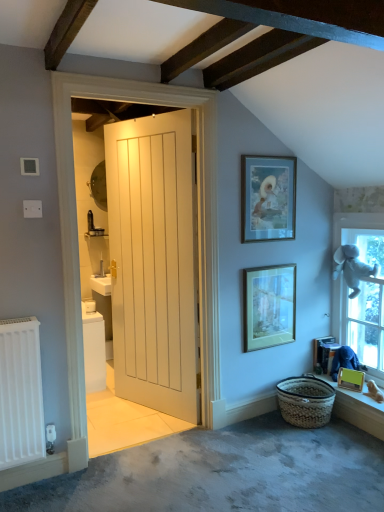
You are a GUI agent. You are given a task and a screenshot of the screen. Output one action in this format:
    pyautogui.click(x=<x>, y=<y>)
    Task: Click on the wooden changing table at lower right
    The width and height of the screenshot is (384, 512).
    Given the screenshot: What is the action you would take?
    pyautogui.click(x=324, y=353)

This screenshot has height=512, width=384. Identify the location of matte glass picture frame at center, the second picture frame from the bottom. (269, 306).

Where is `wooden window sill at lower right`? The height and width of the screenshot is (512, 384). wooden window sill at lower right is located at coordinates [x=358, y=409].

In order to face white plush toy at right, should I rotate leftwards or rightwards?

To face it directly, rotate right by 21.962 degrees.

Locate an element on the screen. matte yellow picture frame at lower right, the 3th picture frame in the top-to-bottom sequence is located at coordinates (350, 379).

Is white wooden door at center taller than matte gold picture frame at upper center, placed as the third picture frame when sorted from bottom to top?

Correct, white wooden door at center is much taller as matte gold picture frame at upper center, placed as the third picture frame when sorted from bottom to top.

From the image's perspective, is white wooden door at center located above or below matte gold picture frame at upper center, placed as the third picture frame when sorted from bottom to top?

white wooden door at center is situated lower than matte gold picture frame at upper center, placed as the third picture frame when sorted from bottom to top, in the image.

Is point (174, 157) behind point (286, 158)?

No, (174, 157) is closer to viewer.

Is wooden changing table at lower right positioned in front of white plush toy at right?

No, it is behind white plush toy at right.

Considering the sizes of objects wooden changing table at lower right and white plush toy at right in the image provided, who is thinner, wooden changing table at lower right or white plush toy at right?

white plush toy at right.

Is wooden changing table at lower right oriented away from white plush toy at right?

Yes, wooden changing table at lower right's orientation is away from white plush toy at right.

Is wooden window sill at lower right positioned in front of braided straw basket at lower right?

Yes.

Considering the relative positions of wooden window sill at lower right and braided straw basket at lower right in the image provided, is wooden window sill at lower right to the left of braided straw basket at lower right from the viewer's perspective?

Incorrect, wooden window sill at lower right is not on the left side of braided straw basket at lower right.

From the image's perspective, who appears lower, wooden window sill at lower right or braided straw basket at lower right?

braided straw basket at lower right, from the image's perspective.

Can you confirm if wooden window sill at lower right is shorter than braided straw basket at lower right?

Yes.

Does braided straw basket at lower right appear on the right side of matte glass picture frame at center, the 2th picture frame in the top-to-bottom sequence?

Yes, braided straw basket at lower right is to the right of matte glass picture frame at center, the 2th picture frame in the top-to-bottom sequence.

Who is bigger, braided straw basket at lower right or matte glass picture frame at center, the second picture frame from the bottom?

braided straw basket at lower right.

Looking at their sizes, would you say braided straw basket at lower right is wider or thinner than matte glass picture frame at center, which is the 2th picture frame from right to left?

braided straw basket at lower right is wider than matte glass picture frame at center, which is the 2th picture frame from right to left.

How different are the orientations of wooden window sill at lower right and wooden changing table at lower right in degrees?

The angular difference between wooden window sill at lower right and wooden changing table at lower right is 0.879 degrees.

Can you confirm if wooden window sill at lower right is smaller than wooden changing table at lower right?

No, wooden window sill at lower right is not smaller than wooden changing table at lower right.

Is wooden window sill at lower right surrounding wooden changing table at lower right?

No, wooden changing table at lower right is not a part of wooden window sill at lower right.

Between wooden window sill at lower right and wooden changing table at lower right, which one appears on the right side from the viewer's perspective?

From the viewer's perspective, wooden window sill at lower right appears more on the right side.

Considering their positions, is matte glass picture frame at center, the 2th picture frame in the top-to-bottom sequence, located in front of or behind braided straw basket at lower right?

matte glass picture frame at center, the 2th picture frame in the top-to-bottom sequence, is behind braided straw basket at lower right.

Does matte glass picture frame at center, which is the second picture frame from left to right, appear on the left side of braided straw basket at lower right?

Yes, matte glass picture frame at center, which is the second picture frame from left to right, is to the left of braided straw basket at lower right.

Considering the sizes of objects matte glass picture frame at center, which is the second picture frame from left to right, and braided straw basket at lower right in the image provided, who is taller, matte glass picture frame at center, which is the second picture frame from left to right, or braided straw basket at lower right?

With more height is matte glass picture frame at center, which is the second picture frame from left to right.

Is matte glass picture frame at center, the 2th picture frame in the top-to-bottom sequence, not inside braided straw basket at lower right?

matte glass picture frame at center, the 2th picture frame in the top-to-bottom sequence, lies outside braided straw basket at lower right's area.

Locate an element on the screen. This screenshot has width=384, height=512. picture frame that is the 1st one when counting upward from the braided straw basket at lower right (from the image's perspective) is located at coordinates (350, 379).

Considering the positions of points (311, 426) and (357, 381), is point (311, 426) farther from camera compared to point (357, 381)?

No, it is in front of (357, 381).

Locate an element on the screen. The height and width of the screenshot is (512, 384). door on the left of the matte gold picture frame at upper center, placed as the first picture frame when sorted from left to right is located at coordinates (154, 262).

Locate an element on the screen. This screenshot has height=512, width=384. window lying in front of the wooden changing table at lower right is located at coordinates (361, 291).

Estimate the real-world distances between objects in this image. Which object is closer to matte yellow picture frame at lower right, which appears as the 1th picture frame when viewed from the right, wooden changing table at lower right or wooden window sill at lower right?

wooden window sill at lower right lies closer to matte yellow picture frame at lower right, which appears as the 1th picture frame when viewed from the right, than the other object.

From the image, which object appears to be farther from braided straw basket at lower right, wooden window sill at lower right or wooden changing table at lower right?

Based on the image, wooden changing table at lower right appears to be further to braided straw basket at lower right.

Which object lies further to the anchor point wooden window sill at lower right, white plush toy at right or matte gold picture frame at upper center, placed as the third picture frame when sorted from bottom to top?

Based on the image, matte gold picture frame at upper center, placed as the third picture frame when sorted from bottom to top, appears to be further to wooden window sill at lower right.

Which object lies further to the anchor point wooden window sill at lower right, braided straw basket at lower right or wooden changing table at lower right?

wooden changing table at lower right is positioned further to the anchor wooden window sill at lower right.

Based on their spatial positions, is wooden window sill at lower right or white plush toy at right closer to braided straw basket at lower right?

The object closer to braided straw basket at lower right is wooden window sill at lower right.

Estimate the real-world distances between objects in this image. Which object is further from white plush toy at right, wooden changing table at lower right or matte glass picture frame at center, the second picture frame from the bottom?

matte glass picture frame at center, the second picture frame from the bottom, lies further to white plush toy at right than the other object.

Looking at the image, which one is located further to wooden changing table at lower right, matte gold picture frame at upper center, which is the first picture frame in top-to-bottom order, or white wooden door at center?

Among the two, white wooden door at center is located further to wooden changing table at lower right.

From the image, which object appears to be nearer to matte glass picture frame at center, the second picture frame from the bottom, braided straw basket at lower right or matte gold picture frame at upper center, positioned as the third picture frame in right-to-left order?

matte gold picture frame at upper center, positioned as the third picture frame in right-to-left order, lies closer to matte glass picture frame at center, the second picture frame from the bottom, than the other object.

Find the location of a particular element. The height and width of the screenshot is (512, 384). window between matte gold picture frame at upper center, which is the first picture frame in top-to-bottom order, and wooden changing table at lower right in the up-down direction is located at coordinates (361, 291).

Identify the location of picture frame between white wooden door at center and matte glass picture frame at center, which is the 2th picture frame from right to left, from left to right. (268, 198).

Image resolution: width=384 pixels, height=512 pixels. What are the coordinates of `changing table between white wooden door at center and wooden window sill at lower right` in the screenshot? It's located at (324, 353).

Identify the location of picture frame between braided straw basket at lower right and wooden window sill at lower right in the horizontal direction. This screenshot has height=512, width=384. (350, 379).